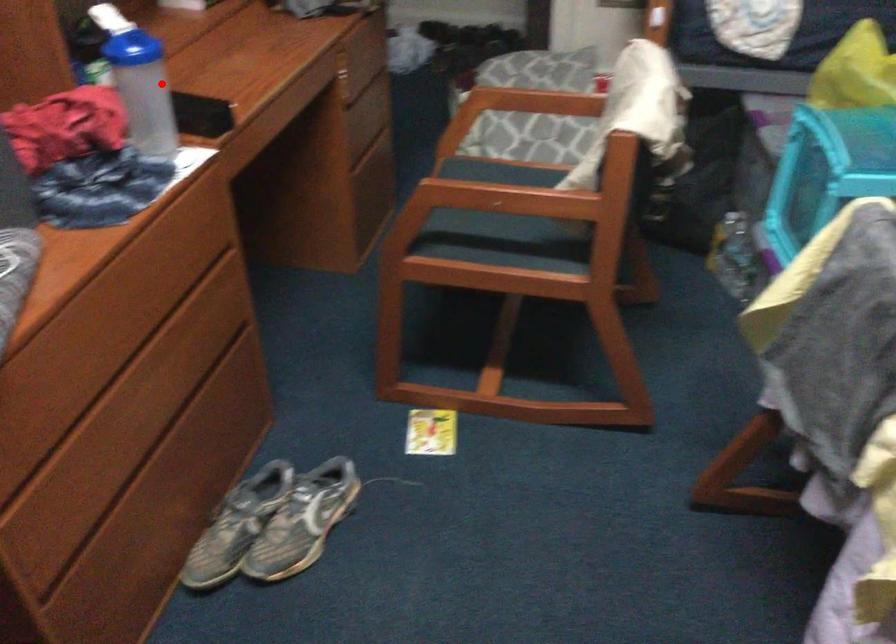
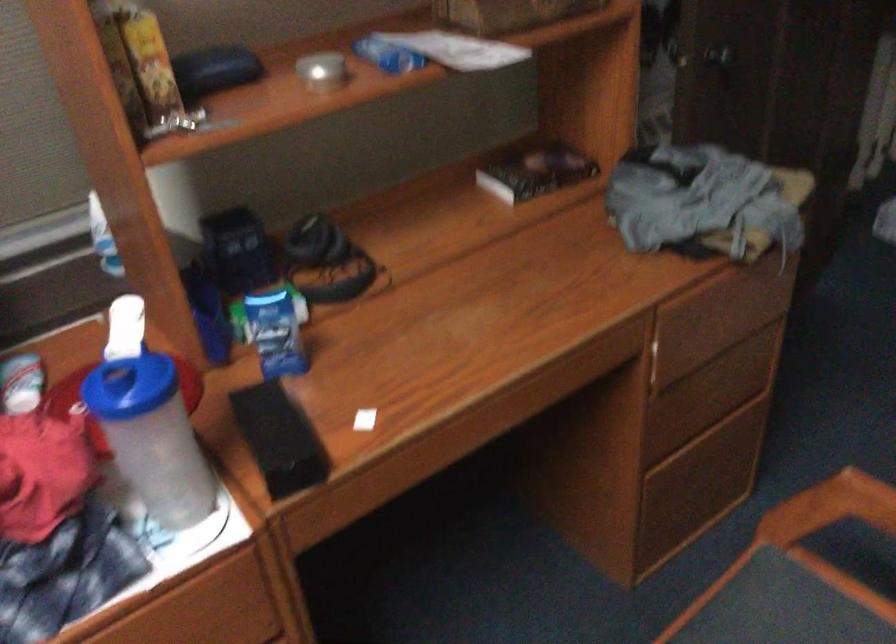
Question: I am providing you with two images of the same scene from different viewpoints. In image1, a red point is highlighted. Considering the same 3D point in image2, which of the following is correct?

Choices:
 (A) It is closer
 (B) It is farther

Answer: (A)